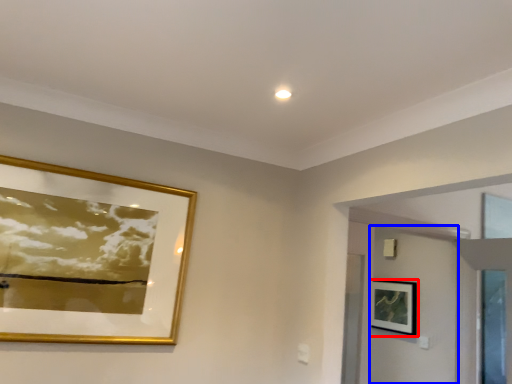
Question: Among these objects, which one is farthest to the camera, picture frame (highlighted by a red box) or door (highlighted by a blue box)?

Choices:
 (A) picture frame
 (B) door

Answer: (A)